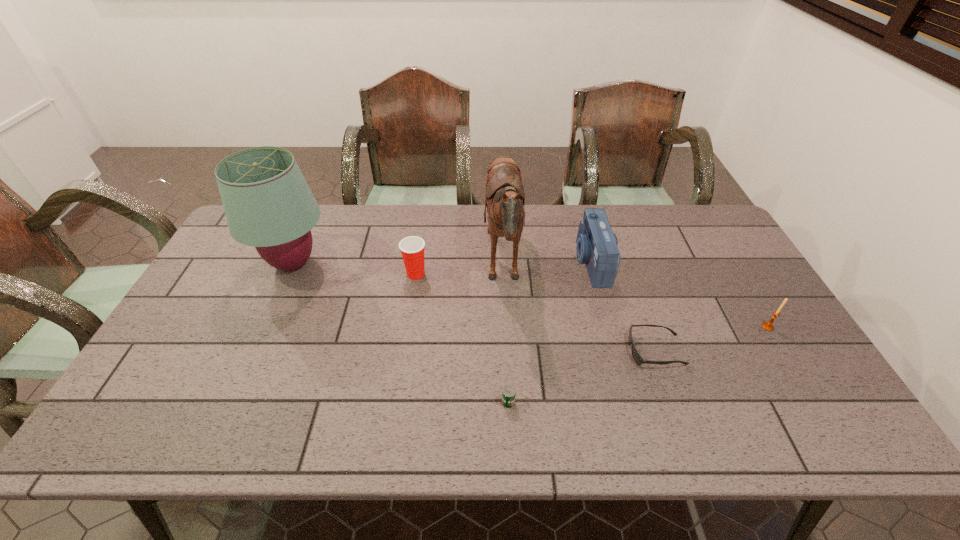
Find the location of a particular element. saddle is located at coordinates (505, 197).

Where is `lampshade`? The width and height of the screenshot is (960, 540). lampshade is located at coordinates (268, 204).

Identify the location of camera. This screenshot has width=960, height=540. (596, 247).

You are a GUI agent. You are given a task and a screenshot of the screen. Output one action in this format:
    pyautogui.click(x=<x>, y=<y>)
    Task: Click on the Dixie cup
    
    Given the screenshot: What is the action you would take?
    pyautogui.click(x=412, y=249)

Locate an element on the screen. The image size is (960, 540). the fifth farthest object is located at coordinates (768, 326).

Find the location of a particular element. The height and width of the screenshot is (540, 960). candle_holder is located at coordinates (768, 326).

The height and width of the screenshot is (540, 960). Identify the location of the second shortest object. (508, 395).

You are a GUI agent. You are given a task and a screenshot of the screen. Output one action in this format:
    pyautogui.click(x=<x>, y=<y>)
    Task: Click on the beer can
    This screenshot has width=960, height=540.
    Given the screenshot: What is the action you would take?
    pyautogui.click(x=508, y=395)

Where is `the sixth farthest object`? the sixth farthest object is located at coordinates (639, 360).

This screenshot has height=540, width=960. What are the coordinates of `the shortest object` in the screenshot? It's located at coord(639,360).